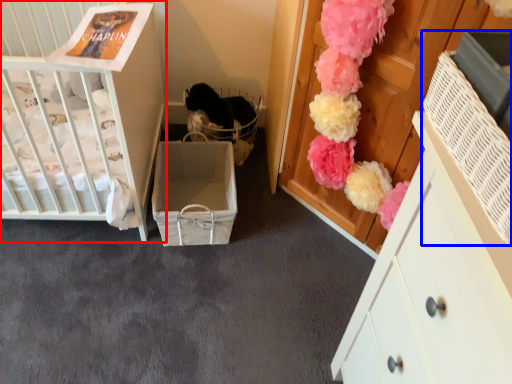
Question: Which point is closer to the camera, infant bed (highlighted by a red box) or storage box (highlighted by a blue box)?

Choices:
 (A) infant bed
 (B) storage box

Answer: (B)